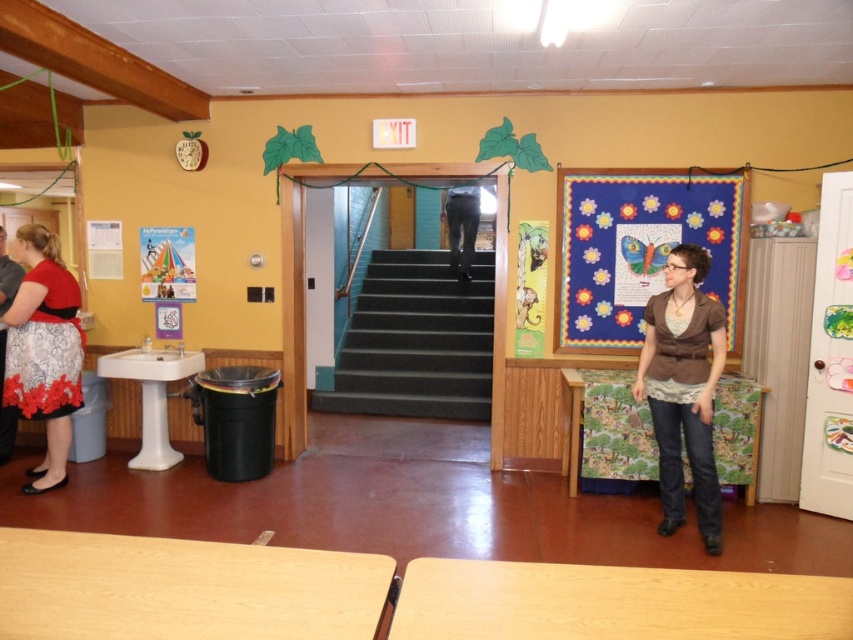
Question: Is floral lace skirt at lower left below black jeans at center?

Choices:
 (A) yes
 (B) no

Answer: (A)

Question: Which object is farther from the camera taking this photo?

Choices:
 (A) black jeans at center
 (B) green carpeted stairs at center
 (C) multicolored fabric butterfly at right
 (D) brown fabric shirt at center

Answer: (A)

Question: Among these objects, which one is farthest from the camera?

Choices:
 (A) multicolored fabric butterfly at right
 (B) brown fabric shirt at center
 (C) floral lace skirt at lower left

Answer: (A)

Question: Among these objects, which one is farthest from the camera?

Choices:
 (A) floral lace skirt at lower left
 (B) multicolored fabric butterfly at right
 (C) brown fabric shirt at center

Answer: (B)

Question: Is green carpeted stairs at center thinner than brown fabric shirt at center?

Choices:
 (A) yes
 (B) no

Answer: (B)

Question: Where is multicolored fabric butterfly at right located in relation to black jeans at center in the image?

Choices:
 (A) right
 (B) left

Answer: (A)